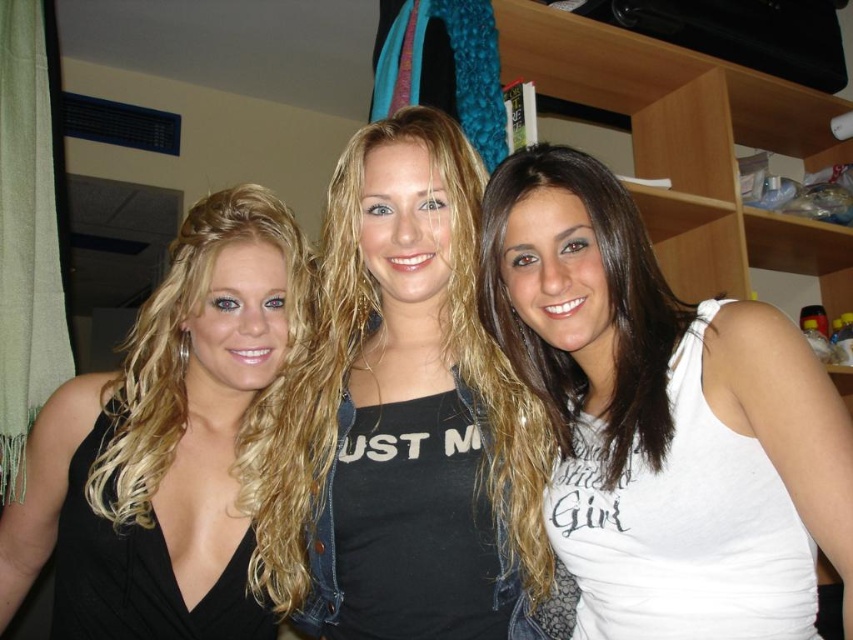
Question: Which of the following is the closest to the observer?

Choices:
 (A) black matte tank top at center
 (B) white matte tank top at center

Answer: (B)

Question: Which object is the farthest from the black matte tank top at center?

Choices:
 (A) black matte dress at left
 (B) white matte tank top at center

Answer: (A)

Question: Which point is farther to the camera?

Choices:
 (A) black matte dress at left
 (B) white matte tank top at center

Answer: (A)

Question: Is black matte dress at left positioned in front of black matte tank top at center?

Choices:
 (A) no
 (B) yes

Answer: (A)

Question: Is white matte tank top at center to the left of black matte tank top at center from the viewer's perspective?

Choices:
 (A) no
 (B) yes

Answer: (A)

Question: Is the position of white matte tank top at center more distant than that of black matte tank top at center?

Choices:
 (A) yes
 (B) no

Answer: (B)